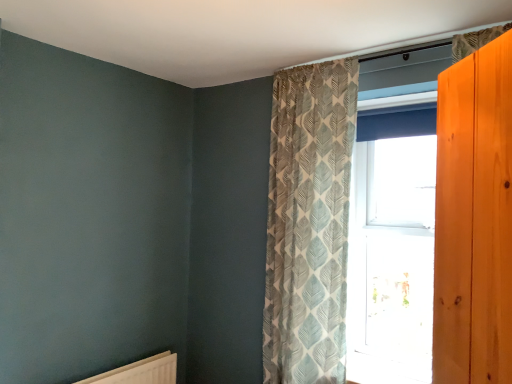
Question: Does textured beige curtain at upper center come in front of white matte radiator at lower left?

Choices:
 (A) yes
 (B) no

Answer: (A)

Question: Is textured beige curtain at upper center aimed at white matte radiator at lower left?

Choices:
 (A) no
 (B) yes

Answer: (A)

Question: From a real-world perspective, is textured beige curtain at upper center beneath white matte radiator at lower left?

Choices:
 (A) yes
 (B) no

Answer: (B)

Question: Can you confirm if textured beige curtain at upper center is positioned to the left of white matte radiator at lower left?

Choices:
 (A) yes
 (B) no

Answer: (B)

Question: Can you confirm if textured beige curtain at upper center is wider than white matte radiator at lower left?

Choices:
 (A) yes
 (B) no

Answer: (A)

Question: Is textured beige curtain at upper center oriented away from white matte radiator at lower left?

Choices:
 (A) no
 (B) yes

Answer: (A)

Question: Is clear glass window at center at the back of white matte radiator at lower left?

Choices:
 (A) no
 (B) yes

Answer: (A)

Question: Can you confirm if white matte radiator at lower left is positioned to the left of clear glass window at center?

Choices:
 (A) no
 (B) yes

Answer: (B)

Question: Is white matte radiator at lower left bigger than clear glass window at center?

Choices:
 (A) yes
 (B) no

Answer: (B)

Question: Is clear glass window at center surrounded by white matte radiator at lower left?

Choices:
 (A) no
 (B) yes

Answer: (A)

Question: From a real-world perspective, is white matte radiator at lower left physically above clear glass window at center?

Choices:
 (A) yes
 (B) no

Answer: (B)

Question: Is white matte radiator at lower left shorter than clear glass window at center?

Choices:
 (A) yes
 (B) no

Answer: (A)

Question: Is textured beige curtain at upper center with clear glass window at center?

Choices:
 (A) yes
 (B) no

Answer: (B)